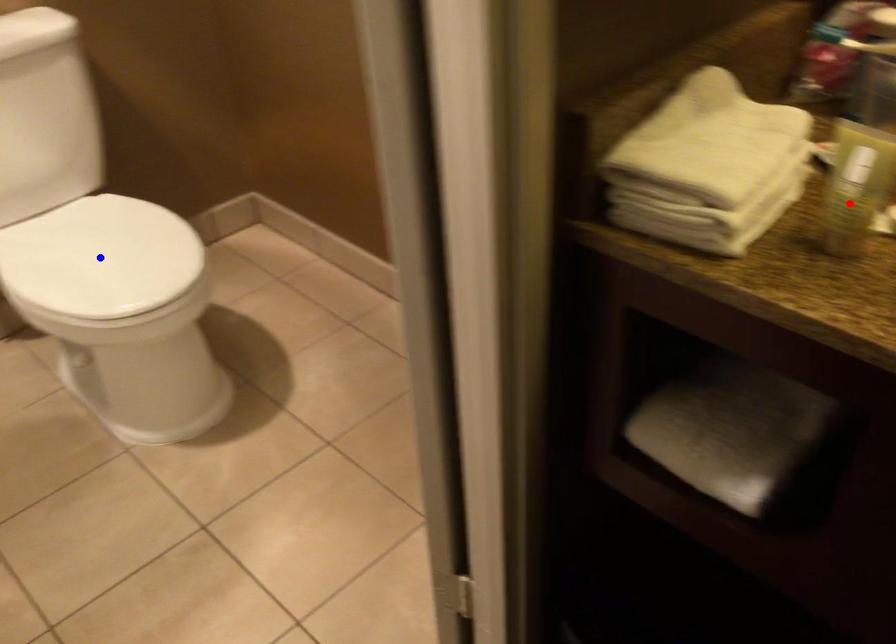
Question: Which of the two points in the image is closer to the camera?

Choices:
 (A) Blue point is closer.
 (B) Red point is closer.

Answer: (B)